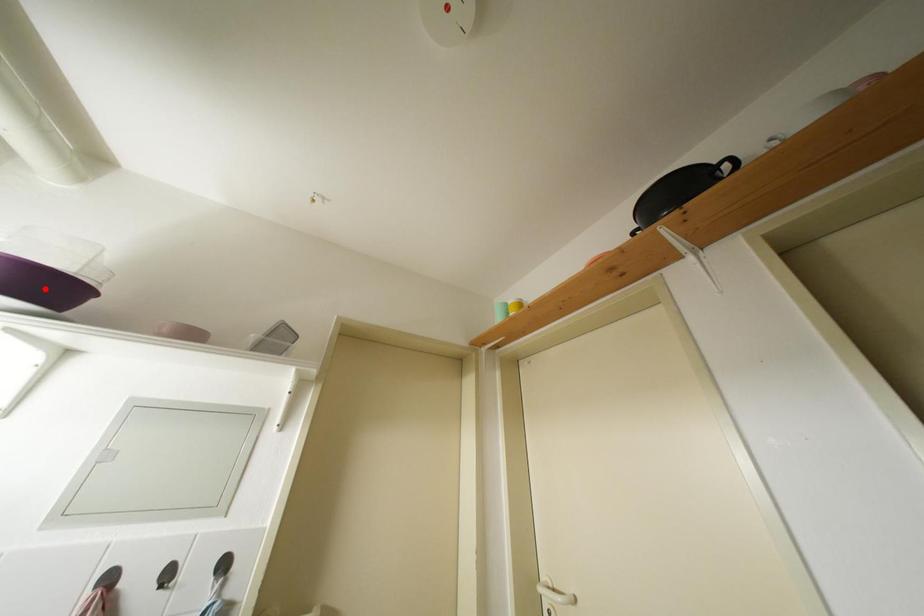
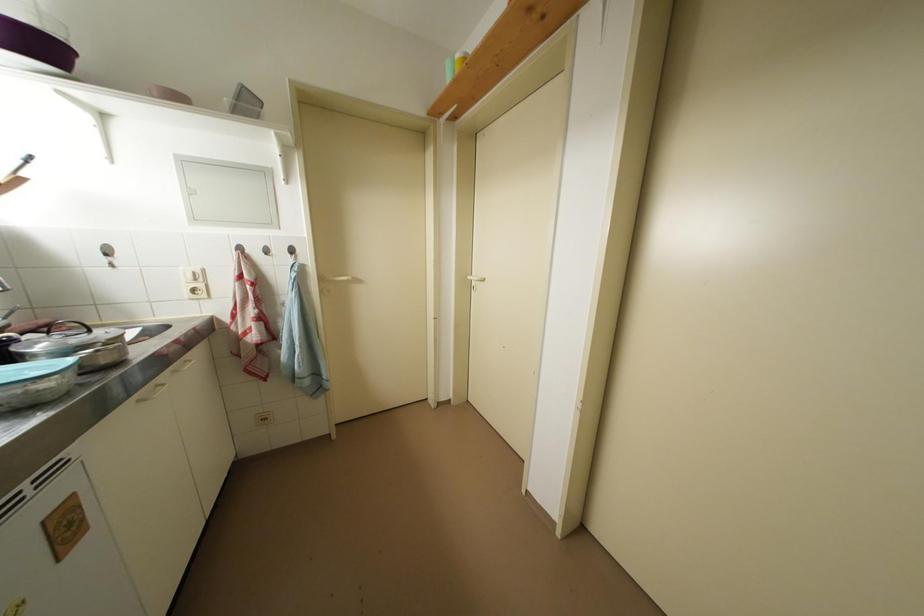
Where in the second image is the point corresponding to the highlighted location from the first image?

(38, 47)